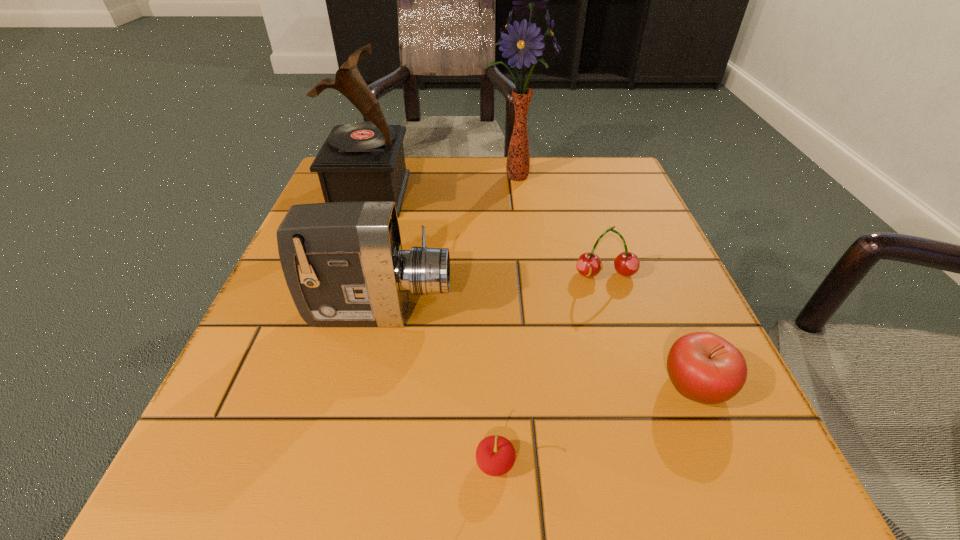
The image size is (960, 540). Identify the location of cherry positioned at the right edge. click(x=589, y=264).

Identify the location of apple at the right edge. pyautogui.click(x=703, y=367).

Where is `object that is at the far left corner`? object that is at the far left corner is located at coordinates (359, 162).

Identify the location of vacant space at the left edge of the desktop. The height and width of the screenshot is (540, 960). (276, 279).

You are a GUI agent. You are given a task and a screenshot of the screen. Output one action in this format:
    pyautogui.click(x=<x>, y=<y>)
    Task: Click on the vacant area at the right edge
    This screenshot has width=960, height=540.
    Given the screenshot: What is the action you would take?
    pyautogui.click(x=628, y=235)

Find the location of a particular element. Image resolution: width=960 pixels, height=540 pixels. vacant region at the near left corner of the desktop is located at coordinates (305, 450).

Locate an element on the screen. The width and height of the screenshot is (960, 540). vacant space at the far right corner of the desktop is located at coordinates (618, 170).

Find the location of `free area in between the farther cherry and the second nearest object`. free area in between the farther cherry and the second nearest object is located at coordinates (651, 330).

You are a GUI agent. You are given a task and a screenshot of the screen. Output one action in this format:
    pyautogui.click(x=<x>, y=<y>)
    Task: Click on the blank region between the shorter cherry and the tallest object
    This screenshot has width=960, height=540.
    Given the screenshot: What is the action you would take?
    pyautogui.click(x=505, y=320)

This screenshot has height=540, width=960. In order to click on vacant area between the fourth shortest object and the right cherry in this screenshot , I will do `click(492, 293)`.